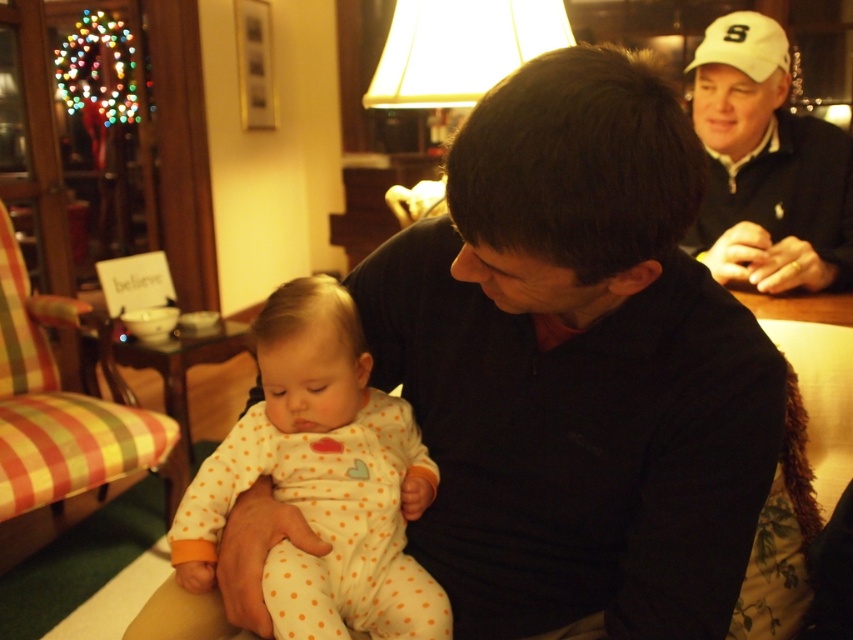
Question: Does matte black shirt at center appear under white polka dot onesie at center?

Choices:
 (A) yes
 (B) no

Answer: (B)

Question: Which of these objects is positioned farthest from the white polka dot onesie at center?

Choices:
 (A) matte black shirt at center
 (B) white matte baseball cap at upper right

Answer: (B)

Question: In this image, where is matte black shirt at center located relative to white matte baseball cap at upper right?

Choices:
 (A) below
 (B) above

Answer: (A)

Question: Which of the following is the closest to the observer?

Choices:
 (A) (741, 280)
 (B) (305, 493)

Answer: (B)

Question: Which object is farther from the camera taking this photo?

Choices:
 (A) white polka dot onesie at center
 (B) matte black shirt at center
 (C) white matte baseball cap at upper right

Answer: (C)

Question: Is white polka dot onesie at center to the right of white matte baseball cap at upper right from the viewer's perspective?

Choices:
 (A) yes
 (B) no

Answer: (B)